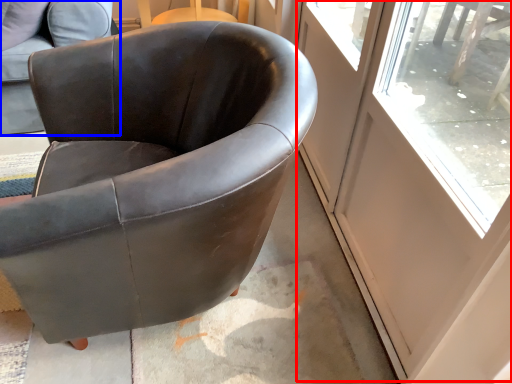
Question: Which point is closer to the camera, screen door (highlighted by a red box) or chair (highlighted by a blue box)?

Choices:
 (A) screen door
 (B) chair

Answer: (A)